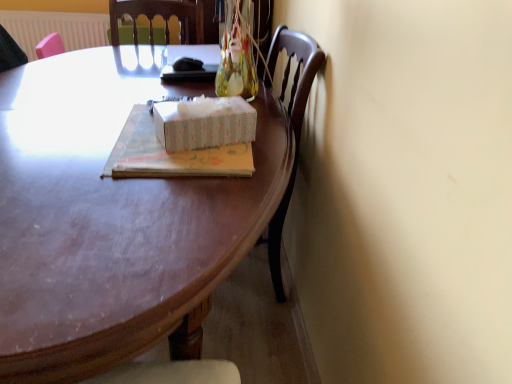
Image resolution: width=512 pixels, height=384 pixels. Find the location of `free location to the right of white paper tissue box at center`. free location to the right of white paper tissue box at center is located at coordinates (273, 142).